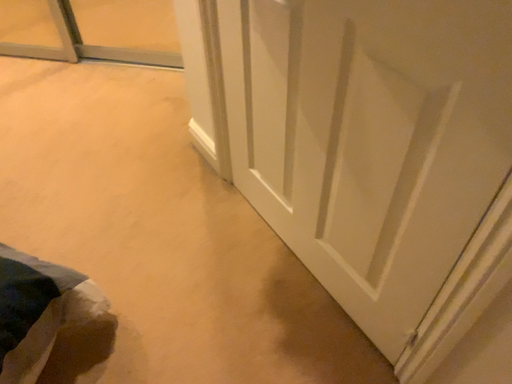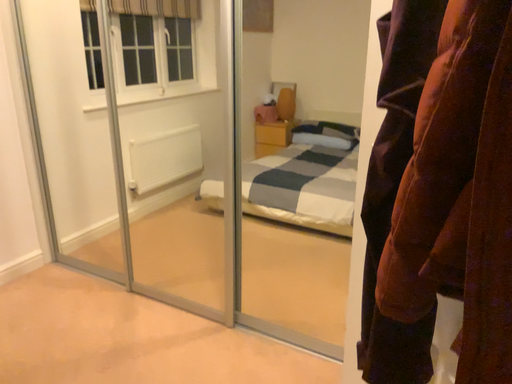
Question: Which way did the camera rotate in the video?

Choices:
 (A) rotated left
 (B) rotated right

Answer: (A)